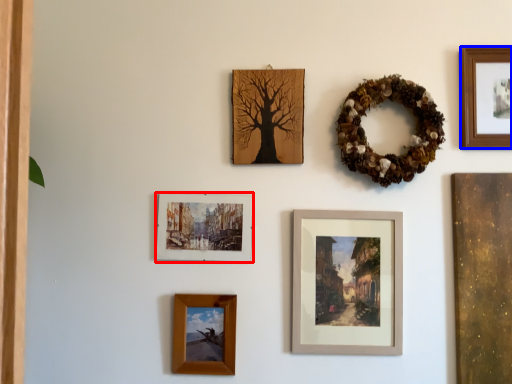
Question: Which object appears closest to the camera in this image, picture frame (highlighted by a red box) or picture frame (highlighted by a blue box)?

Choices:
 (A) picture frame
 (B) picture frame

Answer: (B)